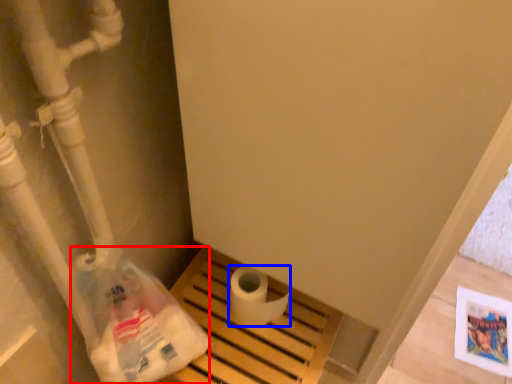
Question: Among these objects, which one is farthest to the camera, paper bag (highlighted by a red box) or toilet paper (highlighted by a blue box)?

Choices:
 (A) paper bag
 (B) toilet paper

Answer: (B)